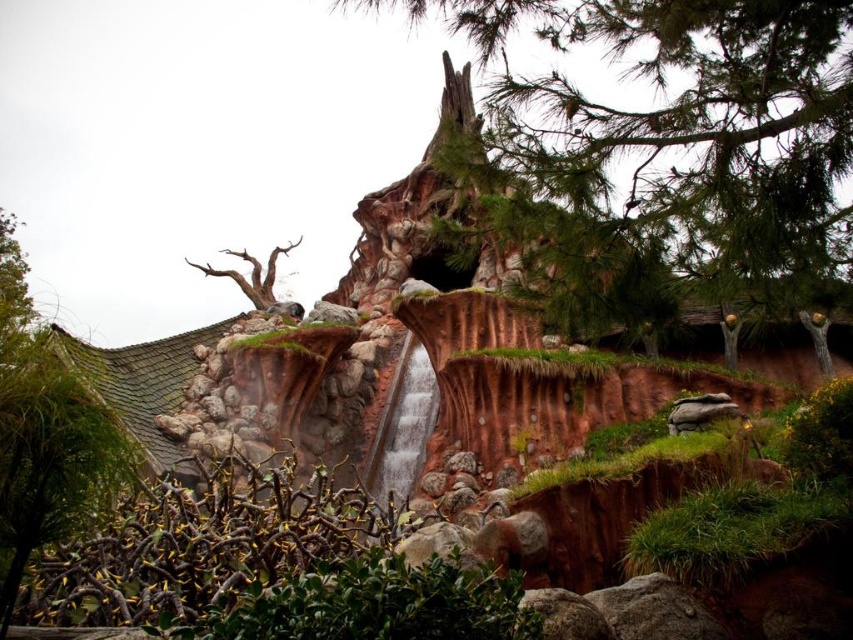
You are standing in the fantastical landscape and want to place a small decorative statue. You have two points marked in the scene, point (47, 339) and point (267, 262). Which point is closer to you where you can place the statue?

Point (47, 339) is closer to the viewer than point (267, 262), so you should place the statue there.

You are standing at the entrance of the fantasy treehouse structure and notice a specific point marked at coordinates (677, 150). What does this point indicate in the scene?

The point at coordinates (677, 150) corresponds to the rough bark tree at center.